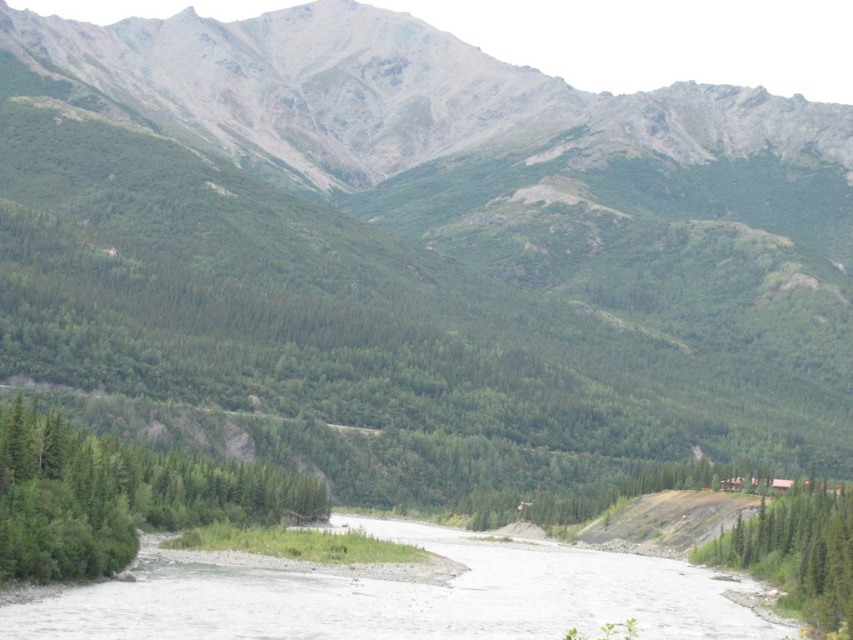
You are standing at the center of the image and want to reach the white gravel river at lower center. According to the coordinates provided, in which direction should you move to get there?

The white gravel river at lower center is located at coordinates point (401, 596). Since you are at the center, you should move towards the lower right direction to reach it.

You are a hiker planning to cross the white gravel river at lower center and the green textured tree at lower right. Which one of these two objects would you encounter first if you start walking from the top of the image towards the bottom?

The green textured tree at lower right is encountered first because it is positioned lower in the frame compared to the white gravel river at lower center, meaning it would come into view sooner as you move downward.

From the picture: You are standing in the valley looking at the green matte tree at lower left and the green textured tree at lower right. Which tree is closer to you?

The green matte tree at lower left is closer to you because it is in front of the green textured tree at lower right, which is positioned behind it.